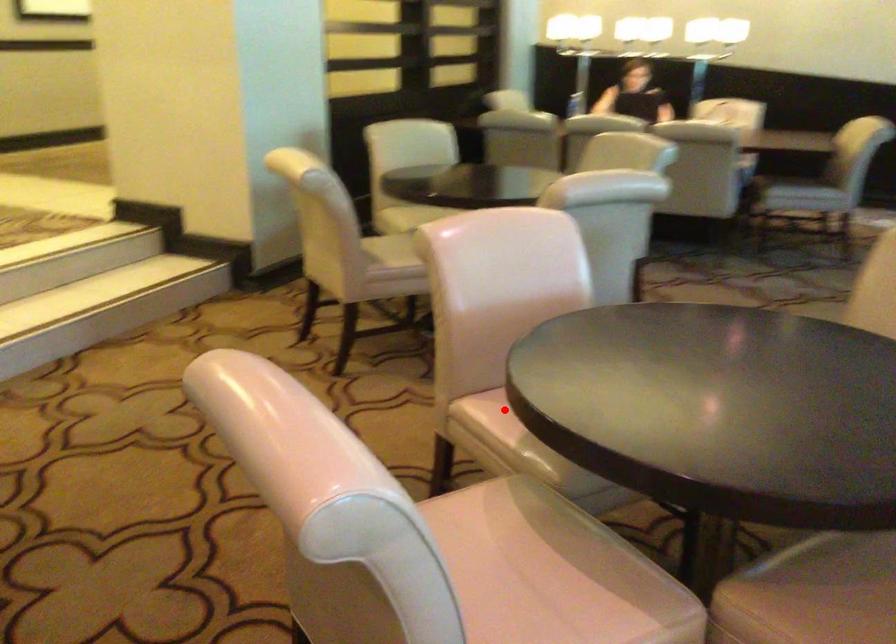
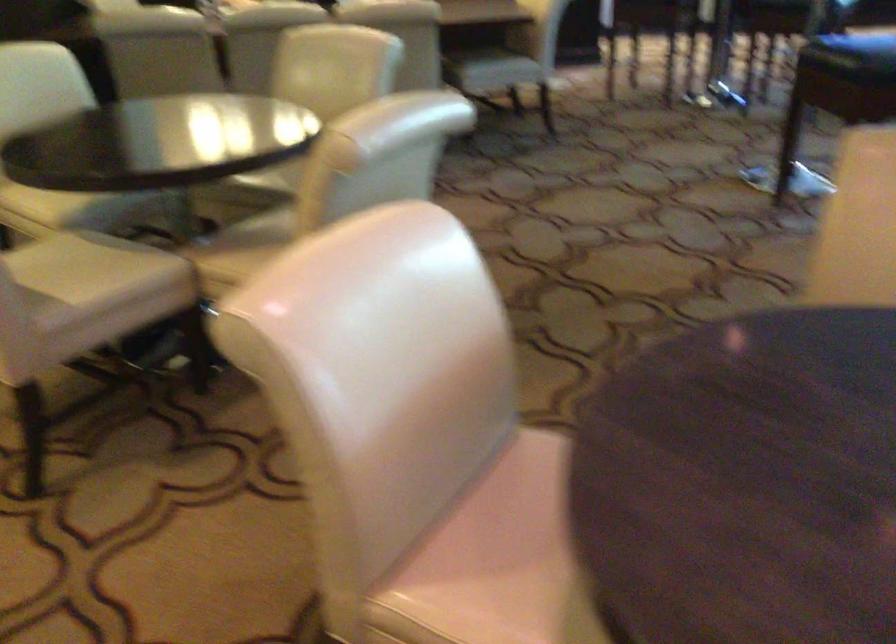
Find the pixel in the second image that matches the highlighted location in the first image.

(488, 597)